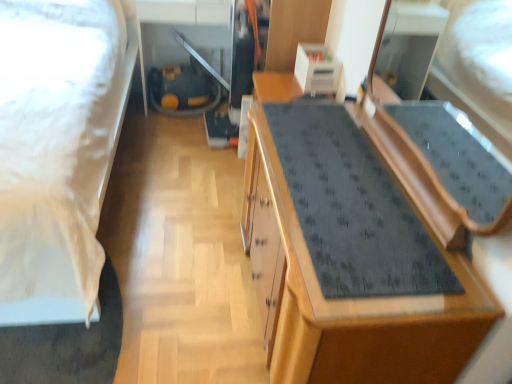
Question: Is the surface of white satin bed at left in direct contact with wooden dresser at center?

Choices:
 (A) yes
 (B) no

Answer: (B)

Question: Is white satin bed at left at the left side of wooden dresser at center?

Choices:
 (A) yes
 (B) no

Answer: (A)

Question: Is white satin bed at left to the right of wooden dresser at center from the viewer's perspective?

Choices:
 (A) no
 (B) yes

Answer: (A)

Question: Does white satin bed at left have a greater height compared to wooden dresser at center?

Choices:
 (A) yes
 (B) no

Answer: (A)

Question: Is white satin bed at left bigger than wooden dresser at center?

Choices:
 (A) no
 (B) yes

Answer: (B)

Question: Would you say white satin bed at left contains wooden dresser at center?

Choices:
 (A) yes
 (B) no

Answer: (B)

Question: Can you confirm if wooden dresser at center is wider than white satin bed at left?

Choices:
 (A) no
 (B) yes

Answer: (A)

Question: Is wooden dresser at center next to white satin bed at left and touching it?

Choices:
 (A) no
 (B) yes

Answer: (A)

Question: From the image's perspective, would you say wooden dresser at center is shown under white satin bed at left?

Choices:
 (A) no
 (B) yes

Answer: (B)

Question: Does wooden dresser at center have a greater height compared to white satin bed at left?

Choices:
 (A) no
 (B) yes

Answer: (A)

Question: Does wooden dresser at center have a lesser height compared to white satin bed at left?

Choices:
 (A) yes
 (B) no

Answer: (A)

Question: From a real-world perspective, is wooden dresser at center positioned over white satin bed at left based on gravity?

Choices:
 (A) no
 (B) yes

Answer: (A)

Question: From the image's perspective, is white satin bed at left located above or below wooden dresser at center?

Choices:
 (A) above
 (B) below

Answer: (A)